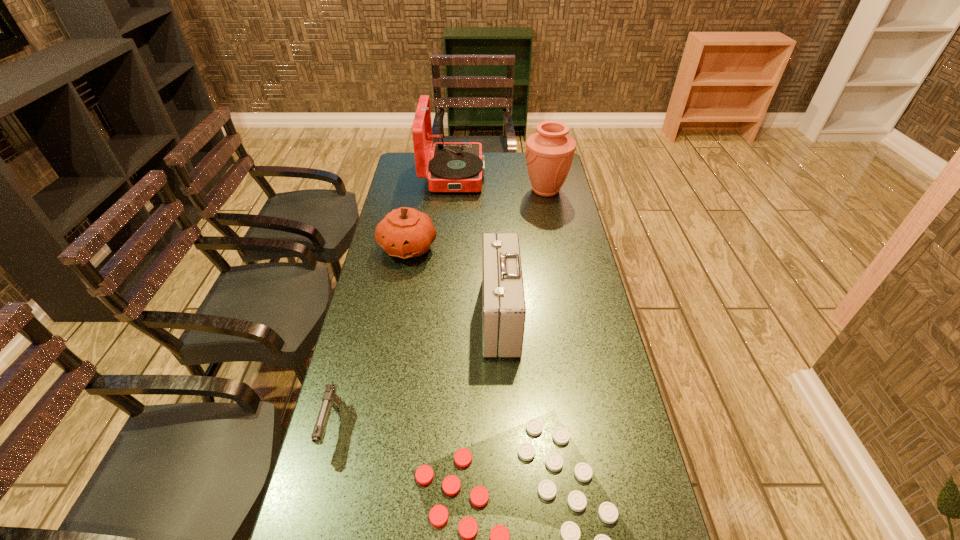
Where is `phonograph_record`? Image resolution: width=960 pixels, height=540 pixels. phonograph_record is located at coordinates (454, 166).

Locate an element on the screen. This screenshot has height=540, width=960. vase is located at coordinates point(549,153).

Identify the location of the third nearest object. The height and width of the screenshot is (540, 960). (504, 311).

The width and height of the screenshot is (960, 540). In order to click on the third tallest object in this screenshot , I will do `click(504, 311)`.

This screenshot has height=540, width=960. What are the coordinates of `the third shortest object` in the screenshot? It's located at (405, 232).

This screenshot has height=540, width=960. Identify the location of the third farthest object. (405, 232).

Find the location of a particular element. gun is located at coordinates (330, 399).

Find the location of a particular element. Image resolution: width=960 pixels, height=540 pixels. vacant space located on the front-facing side of the phonograph_record is located at coordinates (555, 174).

Where is `vacant space located 0.100m on the front of the vase`? This screenshot has width=960, height=540. vacant space located 0.100m on the front of the vase is located at coordinates (551, 217).

Locate an element on the screen. This screenshot has width=960, height=540. vacant space located 0.240m on the front-facing side of the third tallest object is located at coordinates (406, 316).